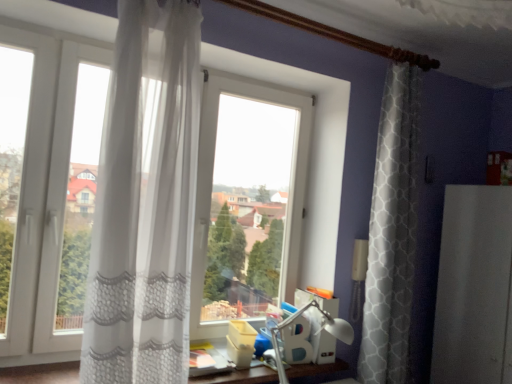
Question: From a real-world perspective, is white matte screen door at right located beneath white plastic table lamp at center?

Choices:
 (A) yes
 (B) no

Answer: (B)

Question: Is white matte screen door at right far away from white plastic table lamp at center?

Choices:
 (A) yes
 (B) no

Answer: (B)

Question: Is white matte screen door at right smaller than white plastic table lamp at center?

Choices:
 (A) no
 (B) yes

Answer: (A)

Question: Considering the relative positions of white matte screen door at right and white plastic table lamp at center in the image provided, is white matte screen door at right to the right of white plastic table lamp at center from the viewer's perspective?

Choices:
 (A) yes
 (B) no

Answer: (A)

Question: Considering the relative sizes of white matte screen door at right and white plastic table lamp at center in the image provided, is white matte screen door at right bigger than white plastic table lamp at center?

Choices:
 (A) no
 (B) yes

Answer: (B)

Question: Is white matte screen door at right in contact with white plastic table lamp at center?

Choices:
 (A) no
 (B) yes

Answer: (A)

Question: Can you confirm if white sheer curtain at left is smaller than white matte screen door at right?

Choices:
 (A) no
 (B) yes

Answer: (B)

Question: Can you confirm if white sheer curtain at left is taller than white matte screen door at right?

Choices:
 (A) yes
 (B) no

Answer: (A)

Question: Is white sheer curtain at left beside white matte screen door at right?

Choices:
 (A) yes
 (B) no

Answer: (B)

Question: From the image's perspective, is white sheer curtain at left located above white matte screen door at right?

Choices:
 (A) no
 (B) yes

Answer: (B)

Question: From a real-world perspective, is white sheer curtain at left on top of white matte screen door at right?

Choices:
 (A) yes
 (B) no

Answer: (A)

Question: Can white matte screen door at right be found inside white sheer curtain at left?

Choices:
 (A) no
 (B) yes

Answer: (A)

Question: Is white sheer curtain at left closer to the viewer compared to white plastic table lamp at center?

Choices:
 (A) no
 (B) yes

Answer: (B)